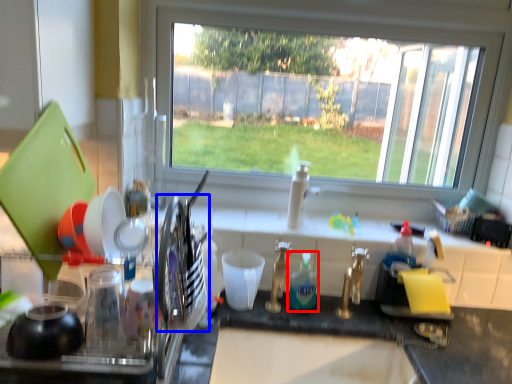
Question: Among these objects, which one is farthest to the camera, cleaning product (highlighted by a red box) or tableware (highlighted by a blue box)?

Choices:
 (A) cleaning product
 (B) tableware

Answer: (A)